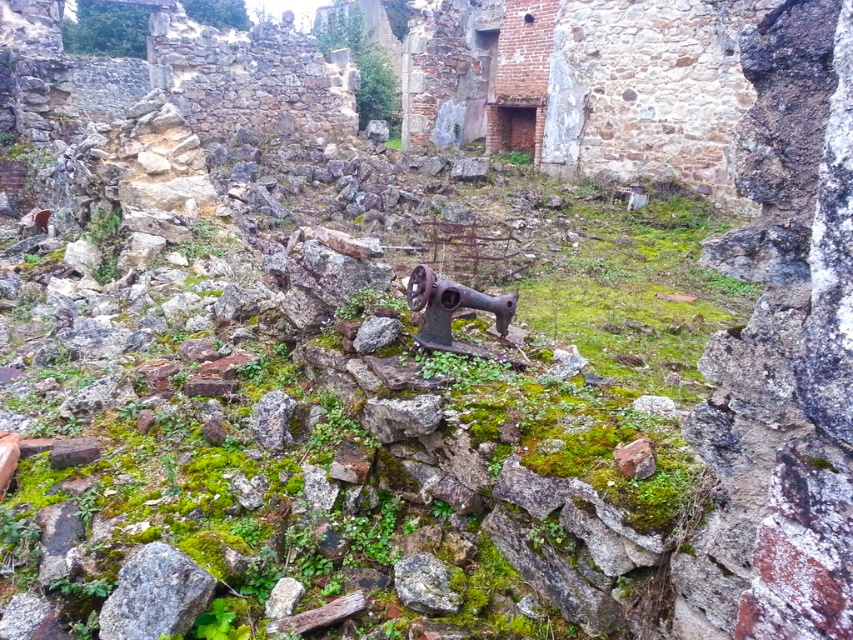
Question: Considering the real-world distances, which object is closest to the gray rough stone at lower left?

Choices:
 (A) rusty metal sewing machine at center
 (B) rusty metal stone at center

Answer: (B)

Question: Which point is closer to the camera?

Choices:
 (A) rusty metal sewing machine at center
 (B) rusty metal stone at center
 (C) gray rough stone at lower left

Answer: (C)

Question: Can you confirm if gray rough stone at lower left is thinner than rusty metal sewing machine at center?

Choices:
 (A) yes
 (B) no

Answer: (A)

Question: Is rusty metal sewing machine at center further to camera compared to rusty metal stone at center?

Choices:
 (A) no
 (B) yes

Answer: (B)

Question: Which object appears closest to the camera in this image?

Choices:
 (A) rusty metal sewing machine at center
 (B) gray rough stone at lower left

Answer: (B)

Question: Is gray rough stone at lower left positioned at the back of rusty metal stone at center?

Choices:
 (A) no
 (B) yes

Answer: (A)